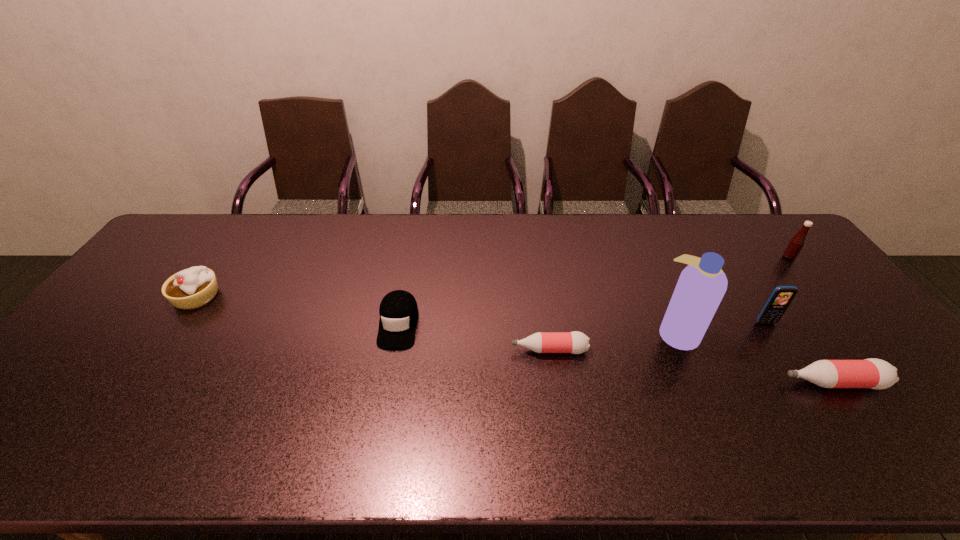
At what (x,y) coordinates should I click in order to perform the action: click on free space that is in between the sixth object from right to left and the rightmost object. Please return your answer as a coordinate pair (x, y). The image size is (960, 540). Looking at the image, I should click on (593, 291).

I want to click on unoccupied area between the fourth shortest object and the taller bottle, so click(515, 340).

You are a GUI agent. You are given a task and a screenshot of the screen. Output one action in this format:
    pyautogui.click(x=<x>, y=<y>)
    Task: Click on the unoccupied area between the farther bottle and the leftmost object
    
    Given the screenshot: What is the action you would take?
    [373, 323]

The image size is (960, 540). What are the coordinates of `free space between the tallest object and the cap` in the screenshot? It's located at (538, 329).

The width and height of the screenshot is (960, 540). Find the location of `free spot between the farther bottle and the cap`. free spot between the farther bottle and the cap is located at coordinates (474, 337).

I want to click on blank region between the leftmost object and the taller bottle, so click(x=515, y=340).

This screenshot has height=540, width=960. In order to click on the closest object to the second object from left to right in this screenshot , I will do `click(575, 342)`.

Identify the location of object that is the fifth nearest to the rightmost object. (398, 311).

You are a GUI agent. You are given a task and a screenshot of the screen. Output one action in this format:
    pyautogui.click(x=<x>, y=<y>)
    Task: Click on the vacant space that satisfies the following two spatial constraints: 1. on the screen of the cellular telephone; 2. with the cap open on the farther bottle
    Image resolution: width=960 pixels, height=540 pixels.
    Given the screenshot: What is the action you would take?
    pyautogui.click(x=783, y=350)

Identify the location of free space in the image that satisfies the following two spatial constraints: 1. on the screen of the cellular telephone; 2. with the cap open on the shortest object. (783, 350).